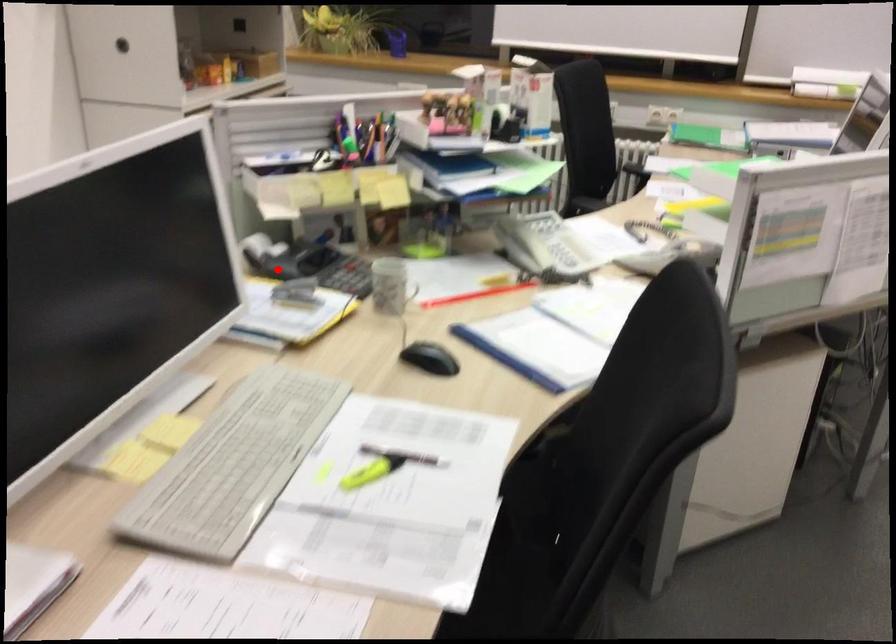
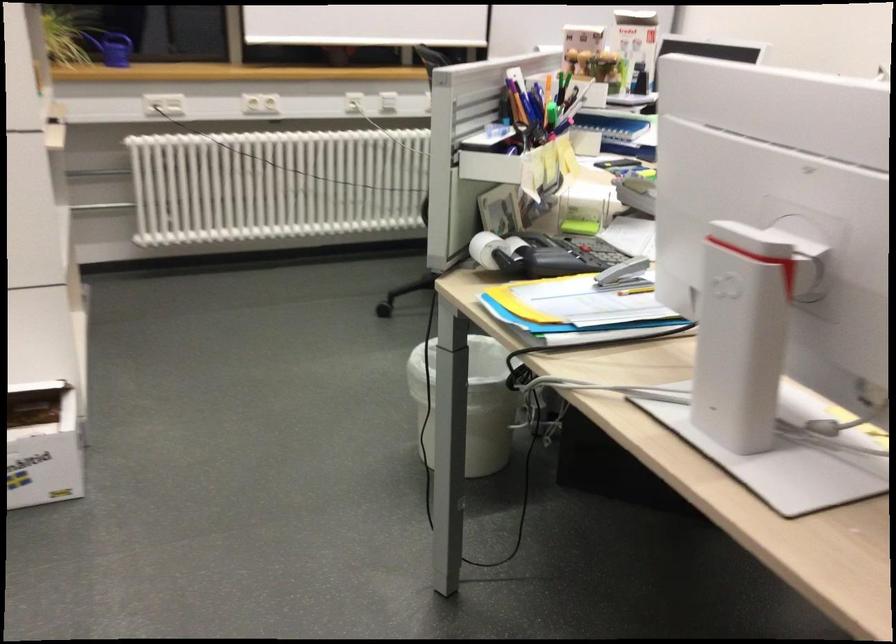
In the second image, find the point that corresponds to the highlighted location in the first image.

(554, 259)